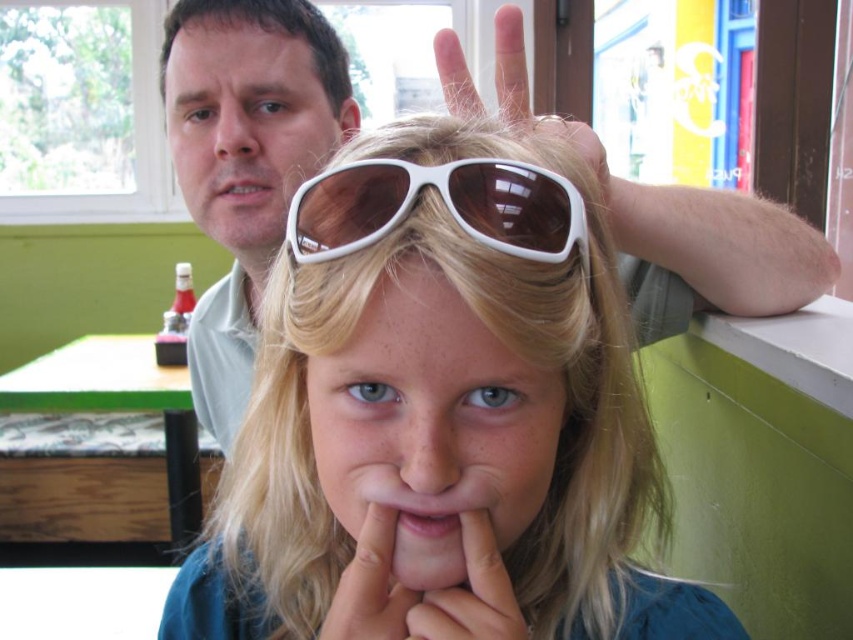
You are a customer in a store and see two pairs of sunglasses at center. The first pair are white plastic sunglasses at center, and the second pair are white matte sunglasses at center. Which pair is positioned to the left?

The white plastic sunglasses at center is positioned to the left of the white matte sunglasses at center.

You are a customer in this dining establishment and want to place your phone on the table. The table is located at point 0.623, 0.518. There is a white plastic sunglasses at center. Can you place your phone on the table without moving the sunglasses?

The white plastic sunglasses at center is located at point (440, 397), which is the same location as the table. Therefore, you cannot place your phone there without moving the sunglasses.

You are a customer in a restaurant and want to place your white plastic sunglasses at center on top of your white matte hand at center. Can the sunglasses fit entirely on the hand without hanging off the edges?

The white plastic sunglasses at center is wider than the white matte hand at center, so placing the sunglasses on top of the hand would cause parts of the sunglasses to hang off the edges.